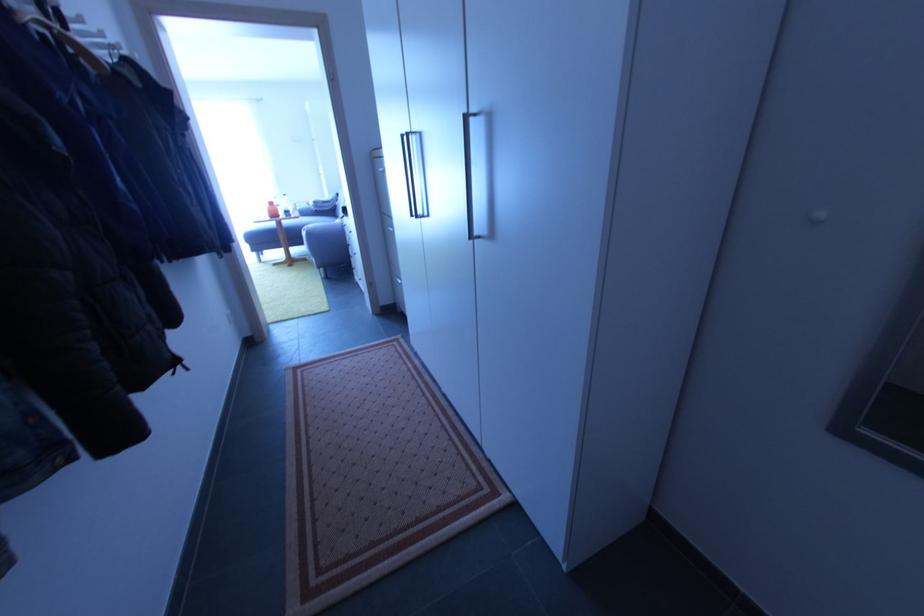
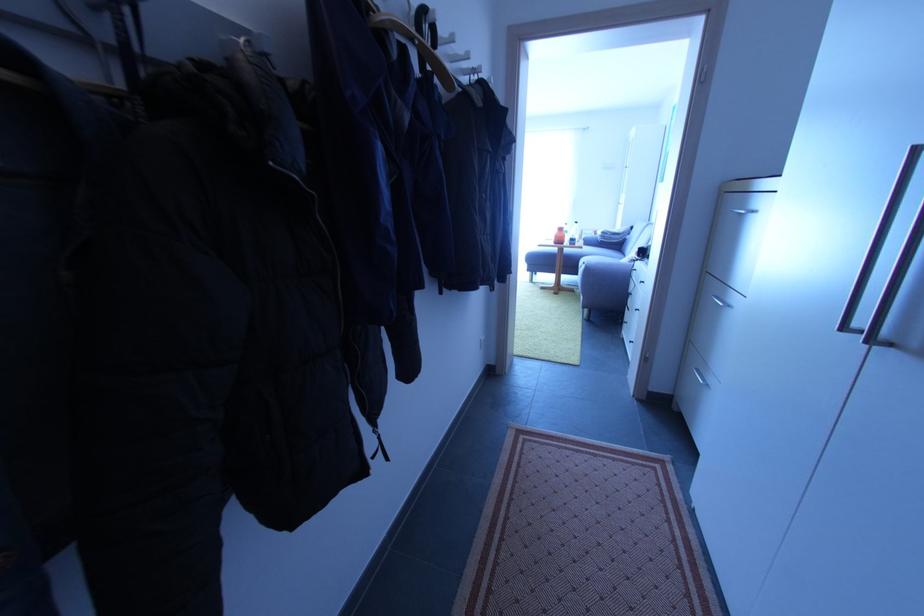
In the second image, find the point that corresponds to pixel 116 49 in the first image.

(479, 71)